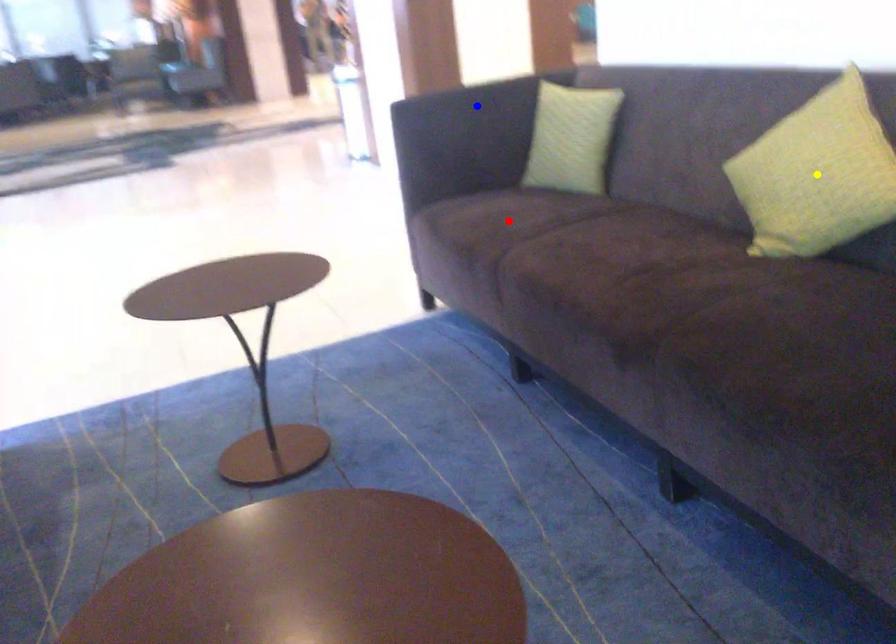
Order these from nearest to farthest:
A) blue point
B) yellow point
C) red point

yellow point < red point < blue point